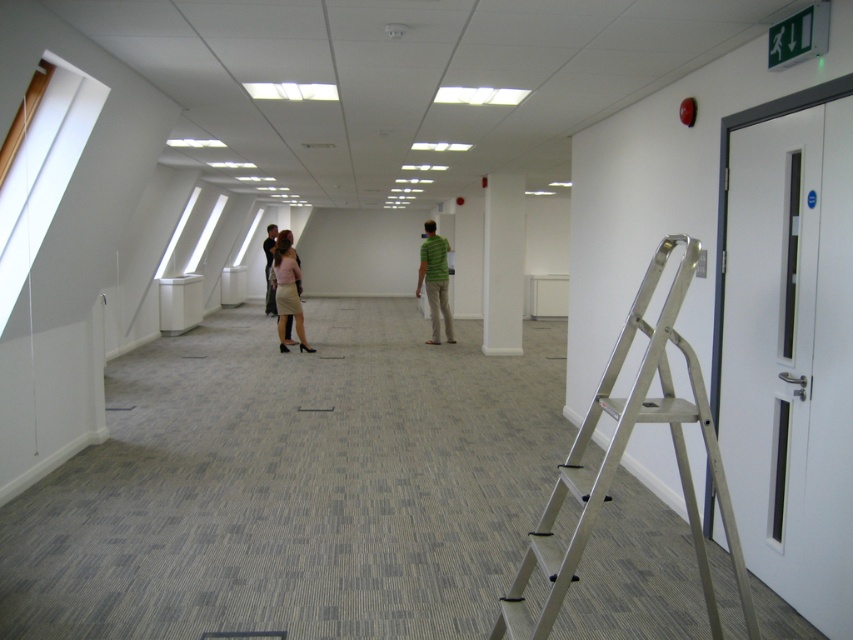
Question: Which point appears closest to the camera in this image?

Choices:
 (A) (282, 339)
 (B) (483, 324)
 (C) (433, 308)
 (D) (271, 312)

Answer: (A)

Question: Which object is closer to the camera taking this photo?

Choices:
 (A) white smooth pillar at center
 (B) matte beige skirt at center
 (C) silver metallic step ladder at right

Answer: (C)

Question: Does white smooth pillar at center come behind matte beige skirt at center?

Choices:
 (A) no
 (B) yes

Answer: (B)

Question: Observing the image, what is the correct spatial positioning of silver metallic step ladder at right in reference to matte beige skirt at center?

Choices:
 (A) left
 (B) right

Answer: (B)

Question: Does silver metallic step ladder at right have a smaller size compared to green matte shirt at center?

Choices:
 (A) yes
 (B) no

Answer: (A)

Question: Which is farther from the matte beige skirt at center?

Choices:
 (A) green matte shirt at center
 (B) white smooth pillar at center
 (C) silver metallic step ladder at right
 (D) light brown leather jacket at center

Answer: (C)